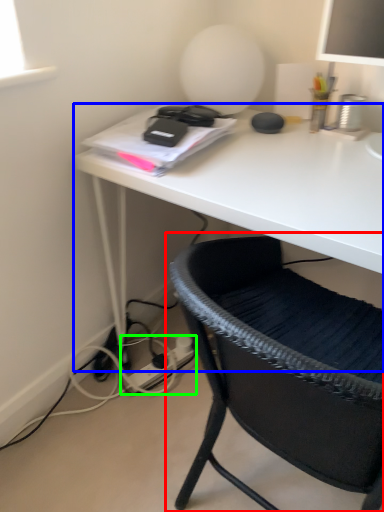
Question: Which is farther away from chair (highlighted by a red box)? desk (highlighted by a blue box) or plug (highlighted by a green box)?

Choices:
 (A) desk
 (B) plug

Answer: (B)